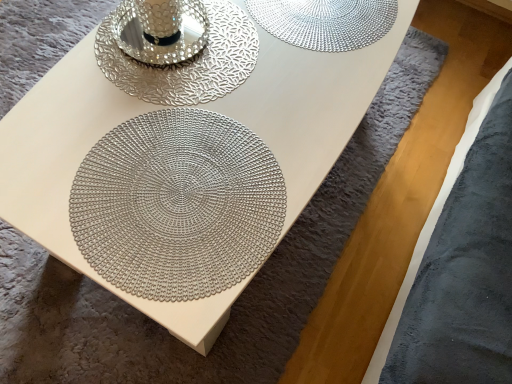
Question: From the image's perspective, is silver textured candle holder at upper center below metallic silver mandala at center?

Choices:
 (A) yes
 (B) no

Answer: (B)

Question: From a real-world perspective, is silver textured candle holder at upper center physically above metallic silver mandala at center?

Choices:
 (A) yes
 (B) no

Answer: (A)

Question: Is silver textured candle holder at upper center oriented towards metallic silver mandala at center?

Choices:
 (A) no
 (B) yes

Answer: (A)

Question: Considering the relative sizes of silver textured candle holder at upper center and metallic silver mandala at center in the image provided, is silver textured candle holder at upper center smaller than metallic silver mandala at center?

Choices:
 (A) no
 (B) yes

Answer: (A)

Question: Is silver textured candle holder at upper center thinner than metallic silver mandala at center?

Choices:
 (A) yes
 (B) no

Answer: (A)

Question: Is silver textured candle holder at upper center facing away from metallic silver mandala at center?

Choices:
 (A) yes
 (B) no

Answer: (B)

Question: Are metallic silver mandala at center and silver textured candle holder at upper center far apart?

Choices:
 (A) no
 (B) yes

Answer: (A)

Question: Is metallic silver mandala at center smaller than silver textured candle holder at upper center?

Choices:
 (A) yes
 (B) no

Answer: (A)

Question: From the image's perspective, is metallic silver mandala at center on silver textured candle holder at upper center?

Choices:
 (A) no
 (B) yes

Answer: (A)

Question: Is metallic silver mandala at center closer to camera compared to silver textured candle holder at upper center?

Choices:
 (A) yes
 (B) no

Answer: (A)

Question: Considering the relative sizes of metallic silver mandala at center and silver textured candle holder at upper center in the image provided, is metallic silver mandala at center shorter than silver textured candle holder at upper center?

Choices:
 (A) yes
 (B) no

Answer: (A)

Question: From a real-world perspective, is metallic silver mandala at center beneath silver textured candle holder at upper center?

Choices:
 (A) yes
 (B) no

Answer: (A)

Question: From their relative heights in the image, would you say metallic silver mandala at center is taller or shorter than silver textured candle holder at upper center?

Choices:
 (A) tall
 (B) short

Answer: (B)